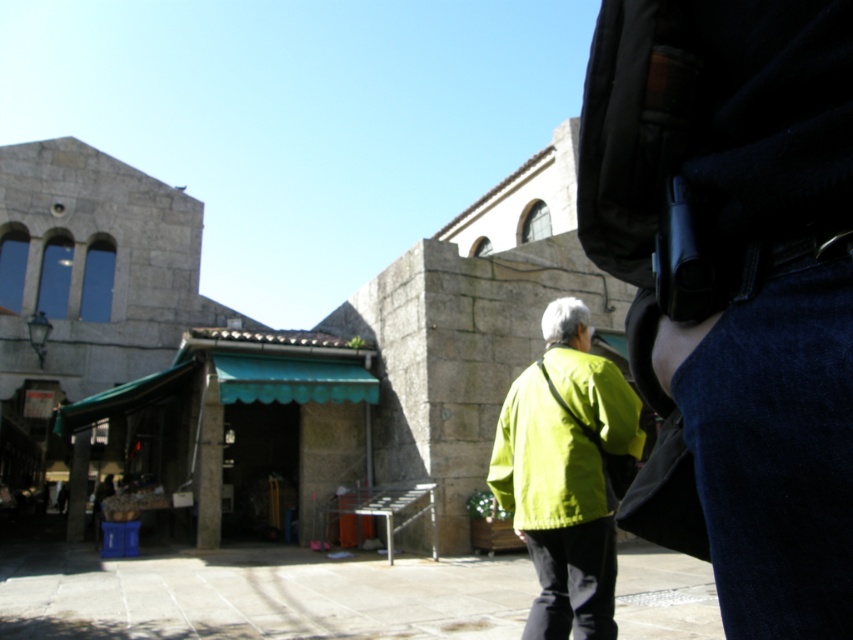
You are a customer at the market stall with a green awning. You notice two black leather belts for sale. One is labeled as the black leather belt at right and the other as the black leather belt at lower right. Which belt is closer to the left side of the stall?

The black leather belt at right is positioned on the left side of the black leather belt at lower right, so the black leather belt at right is closer to the left side of the stall.